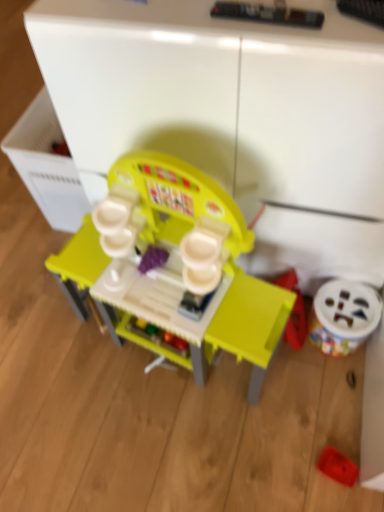
Locate an element on the screen. The width and height of the screenshot is (384, 512). free space between white plastic toy at lower right, which appears as the first toy when viewed from the right, and rubberized red tray at lower right, which is the second toy in left-to-right order is located at coordinates (333, 401).